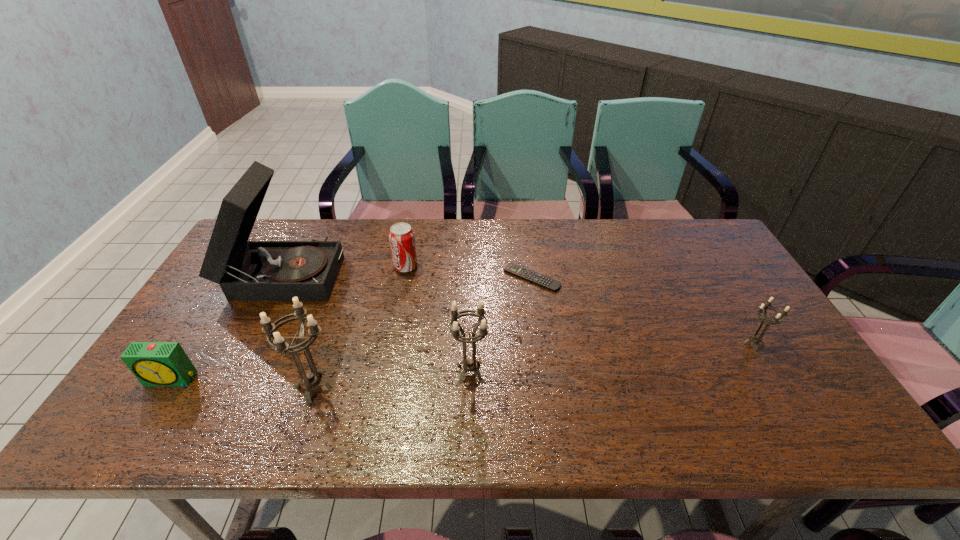
The height and width of the screenshot is (540, 960). What are the coordinates of `free space that satisfies the following two spatial constraints: 1. on the logo side of the fourth object from right to left; 2. on the front-facing side of the second shortest object` in the screenshot? It's located at (384, 379).